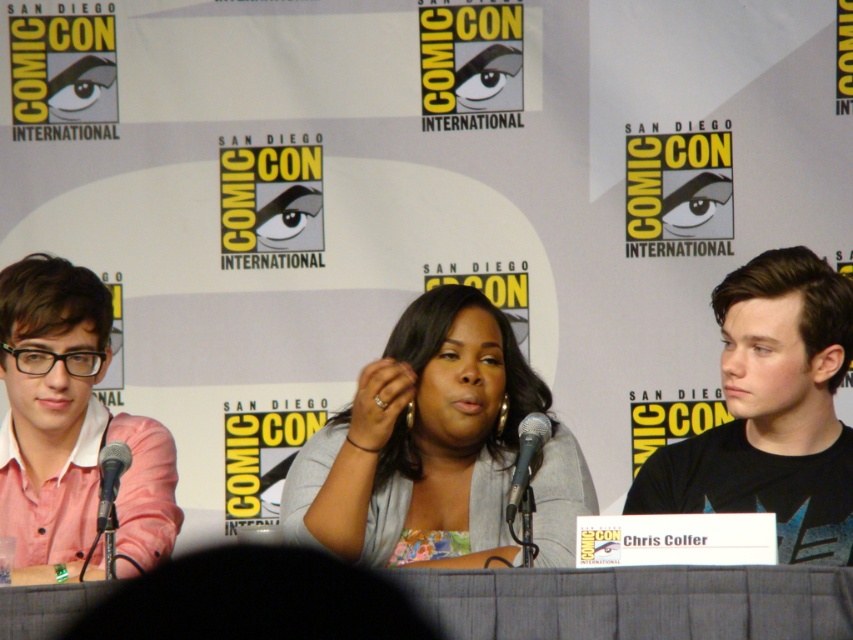
You are a photographer at Comic Con and need to capture a clear shot of the gray fabric at center and the metallic silver microphone at center. Based on their heights, which object will appear larger in the photo?

The gray fabric at center is taller than the metallic silver microphone at center, so it will appear larger in the photo.

You are a photographer at Comic Con and need to capture a clear shot of the black matte shirt at right and the metallic silver microphone at center. Which object should you focus on first if you want to ensure both are in focus without adjusting your camera settings?

The black matte shirt at right is larger than the metallic silver microphone at center, so focusing on the larger object first will help maintain focus on both.

You are standing at the center of the image and want to walk towards the point at coordinates point (770,412). Which direction should you go?

The point (770,412) is on black matte shirt at right, so you should walk towards the right side of the image to reach it.